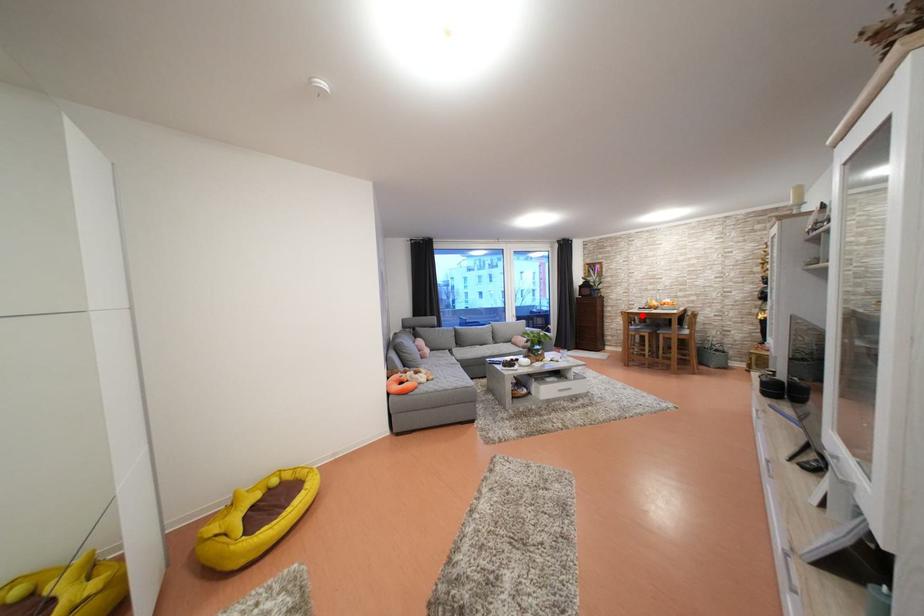
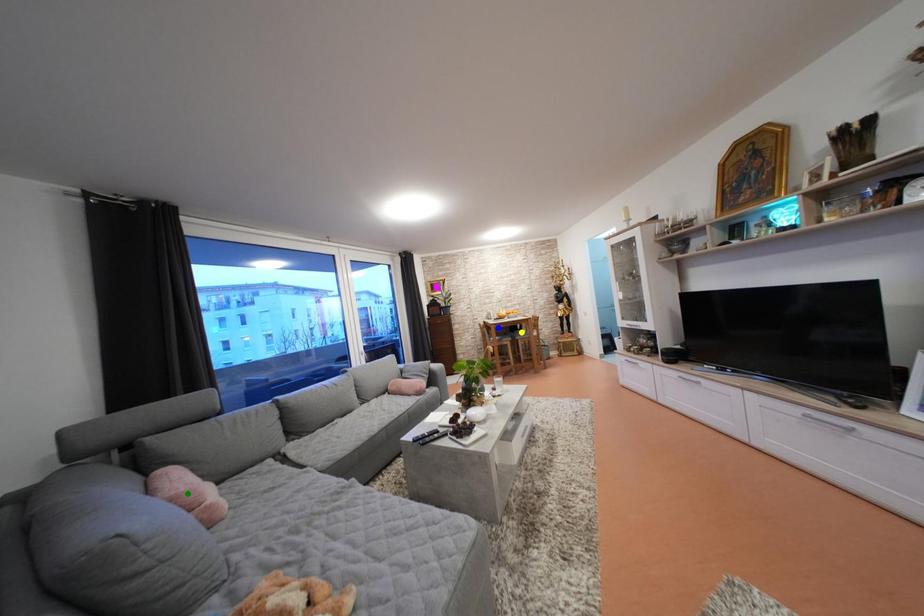
Question: I am providing you with two images of the same scene from different viewpoints. A red point is marked on the first image. You are given multiple points on the second image. Which point in image 2 is actually the same real-world point as the red point in image 1?

Choices:
 (A) blue point
 (B) yellow point
 (C) green point

Answer: (A)